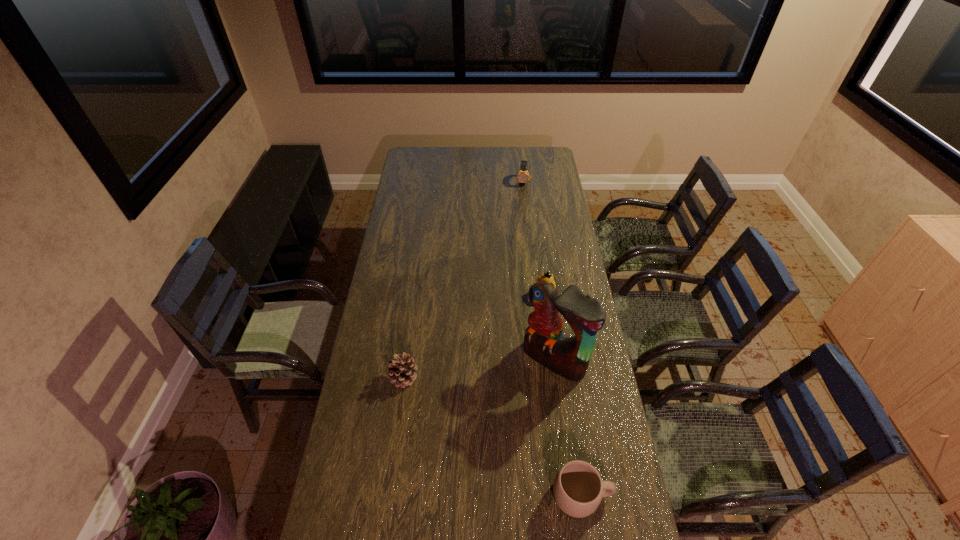
I want to click on the leftmost object, so click(x=401, y=370).

This screenshot has width=960, height=540. Identify the location of the nearest object. pyautogui.click(x=578, y=489).

Image resolution: width=960 pixels, height=540 pixels. I want to click on parrot, so click(543, 340).

Identify the location of duckling. (546, 277).

Identify the location of the farthest object. (x=523, y=176).

This screenshot has width=960, height=540. I want to click on vacant region located on the front of the pinecone, so click(x=399, y=406).

This screenshot has width=960, height=540. What are the coordinates of `vacant space located 0.120m at the face of the tallest object` in the screenshot? It's located at (516, 400).

At what (x,y) coordinates should I click in order to perform the action: click on free space located at the face of the tallest object. Please return your answer as a coordinate pair (x, y). This screenshot has height=540, width=960. Looking at the image, I should click on (497, 421).

Identify the location of vacant area situated 0.350m at the face of the tallest object. (472, 449).

You are a GUI agent. You are given a task and a screenshot of the screen. Output one action in this format:
    pyautogui.click(x=<x>, y=<y>)
    Task: Click on the vacant space located on the face of the fourth nearest object
    
    Given the screenshot: What is the action you would take?
    pyautogui.click(x=528, y=319)